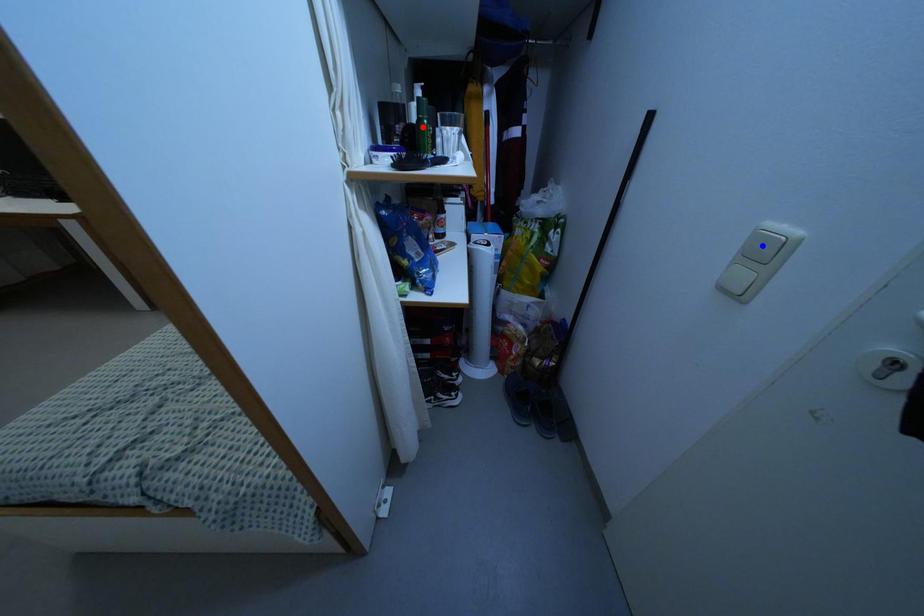
Question: In the image, two points are highlighted. Which point is nearer to the camera? Reply with the corresponding letter.

Choices:
 (A) blue point
 (B) red point

Answer: (A)